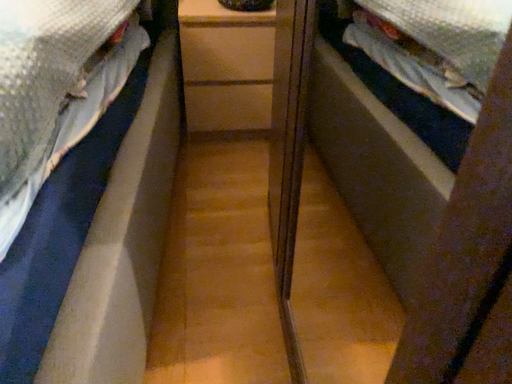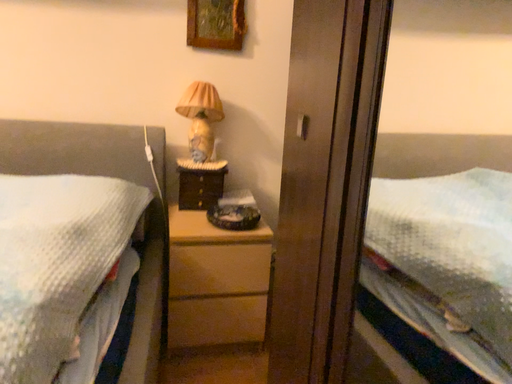
Question: Which way did the camera rotate in the video?

Choices:
 (A) rotated upward
 (B) rotated downward

Answer: (A)